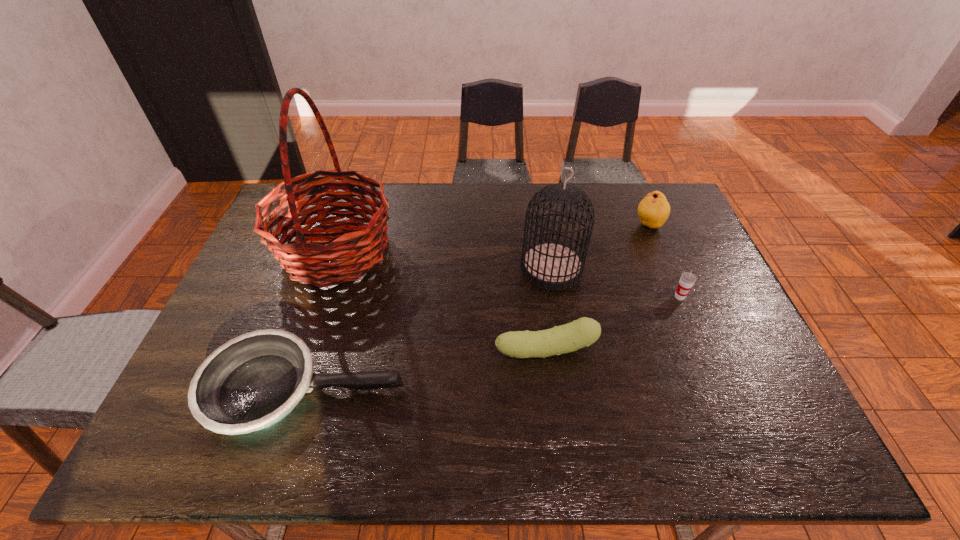
I want to click on vacant space that is in between the birdcage and the pear, so click(600, 246).

Identify the location of free spot between the frying pan and the cucumber. The image size is (960, 540). (425, 370).

At what (x,y) coordinates should I click in order to perform the action: click on vacant space that's between the frying pan and the cup. Please return your answer as a coordinate pair (x, y). The height and width of the screenshot is (540, 960). Looking at the image, I should click on (492, 343).

Find the location of a particular element. The width and height of the screenshot is (960, 540). free space between the shortest object and the cucumber is located at coordinates (425, 370).

Where is `free area in between the shortest object and the pear`? The image size is (960, 540). free area in between the shortest object and the pear is located at coordinates (x=477, y=307).

Identify which object is the fifth closest to the shortest object. Please provide its 2D coordinates. Your answer should be formatted as a tuple, i.e. [(x, y)], where the tuple contains the x and y coordinates of a point satisfying the conditions above.

[(654, 209)]

Find the location of a particular element. The height and width of the screenshot is (540, 960). object that is the fourth nearest to the second tallest object is located at coordinates (253, 381).

What are the coordinates of `free space that satisfies the following two spatial constraints: 1. on the front side of the cucumber; 2. on the handle side of the shortest object` in the screenshot? It's located at (550, 390).

Image resolution: width=960 pixels, height=540 pixels. I want to click on vacant space that satisfies the following two spatial constraints: 1. on the back side of the pear; 2. on the right side of the second tallest object, so click(544, 225).

Locate an element on the screen. This screenshot has height=540, width=960. free space that satisfies the following two spatial constraints: 1. on the front side of the birdcage; 2. on the handle side of the shortest object is located at coordinates (571, 390).